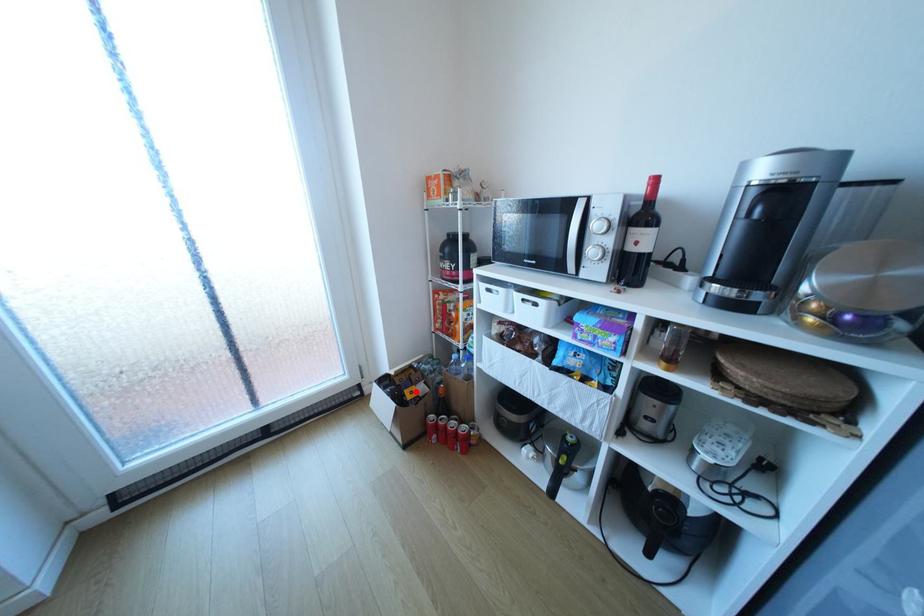
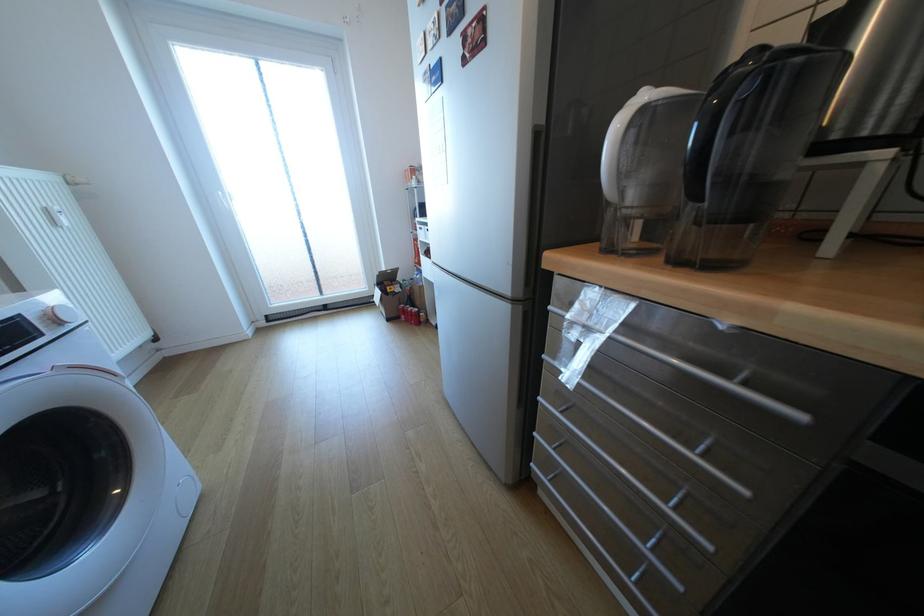
In the second image, find the point that corresponds to the highlighted location in the first image.

(397, 288)